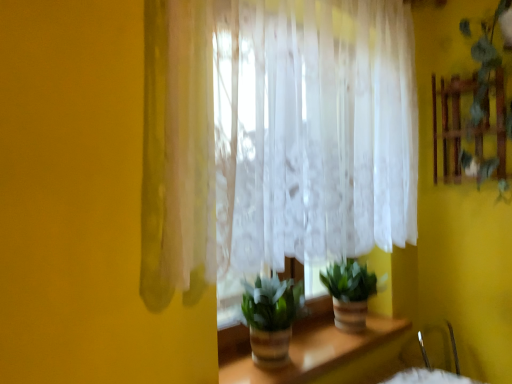
This screenshot has height=384, width=512. I want to click on free space above translucent glass vase at center (from a real-world perspective), so click(322, 339).